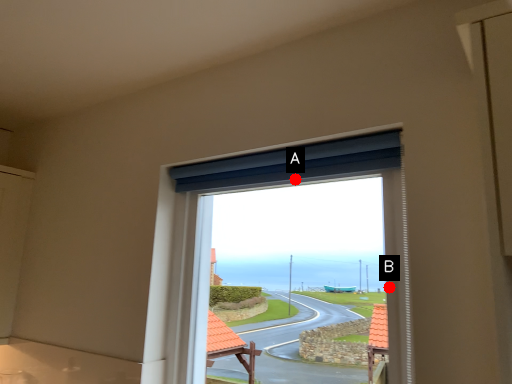
Question: Two points are circled on the image, labeled by A and B beside each circle. Which point is further to the camera?

Choices:
 (A) A is further
 (B) B is further

Answer: (A)